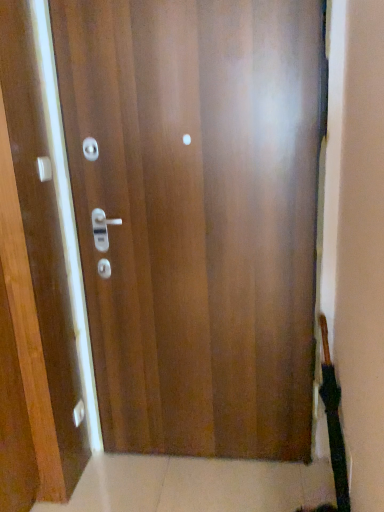
Question: Is matte silver knob at lower left not inside matte white handle at upper left?

Choices:
 (A) no
 (B) yes

Answer: (B)

Question: From a real-world perspective, is matte silver knob at lower left physically below matte white handle at upper left?

Choices:
 (A) no
 (B) yes

Answer: (B)

Question: Does matte silver knob at lower left appear on the left side of matte white handle at upper left?

Choices:
 (A) no
 (B) yes

Answer: (A)

Question: Does matte silver knob at lower left have a lesser height compared to matte white handle at upper left?

Choices:
 (A) no
 (B) yes

Answer: (A)

Question: Considering the relative sizes of matte silver knob at lower left and matte white handle at upper left in the image provided, is matte silver knob at lower left smaller than matte white handle at upper left?

Choices:
 (A) yes
 (B) no

Answer: (A)

Question: In terms of height, does glossy wood door at center look taller or shorter compared to matte silver knob at lower left?

Choices:
 (A) tall
 (B) short

Answer: (A)

Question: Is glossy wood door at center in front of or behind matte silver knob at lower left in the image?

Choices:
 (A) behind
 (B) front

Answer: (B)

Question: From the image's perspective, is glossy wood door at center located above or below matte silver knob at lower left?

Choices:
 (A) below
 (B) above

Answer: (B)

Question: From a real-world perspective, is glossy wood door at center physically located above or below matte silver knob at lower left?

Choices:
 (A) below
 (B) above

Answer: (B)

Question: Considering the positions of matte white handle at upper left and matte silver knob at lower left in the image, is matte white handle at upper left wider or thinner than matte silver knob at lower left?

Choices:
 (A) thin
 (B) wide

Answer: (B)

Question: From a real-world perspective, is matte white handle at upper left positioned above or below matte silver knob at lower left?

Choices:
 (A) above
 (B) below

Answer: (A)

Question: From the image's perspective, is matte white handle at upper left located above or below matte silver knob at lower left?

Choices:
 (A) above
 (B) below

Answer: (A)

Question: Relative to matte silver knob at lower left, is matte white handle at upper left in front or behind?

Choices:
 (A) front
 (B) behind

Answer: (A)

Question: In terms of width, does matte silver knob at lower left look wider or thinner when compared to glossy wood door at center?

Choices:
 (A) thin
 (B) wide

Answer: (A)

Question: In terms of height, does matte silver knob at lower left look taller or shorter compared to glossy wood door at center?

Choices:
 (A) tall
 (B) short

Answer: (B)